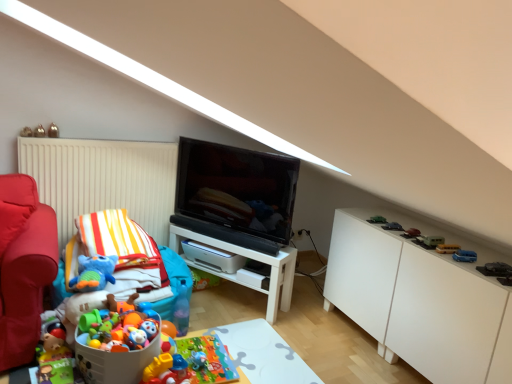
Identify the location of vacant space situated on the left part of white glossy cabinet at right. This screenshot has width=512, height=384. (327, 346).